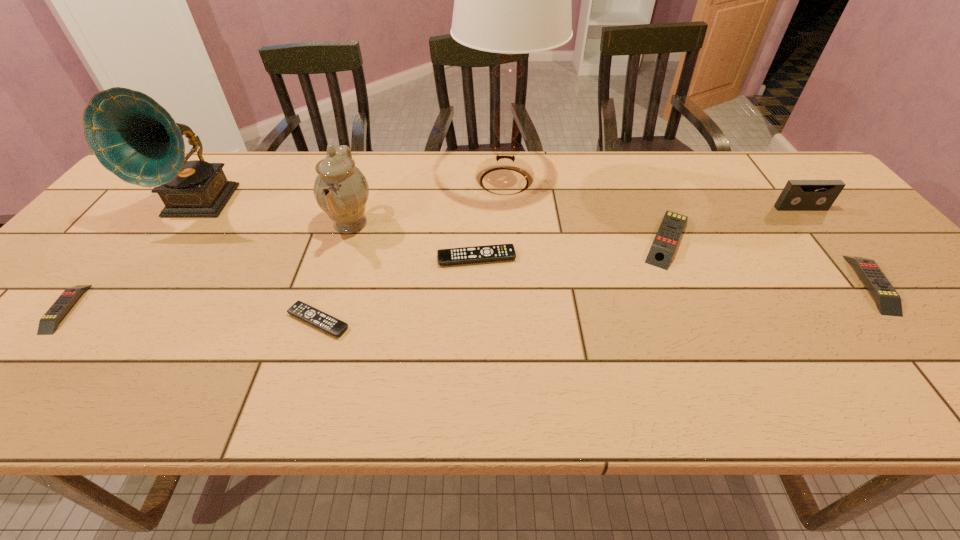
Locate an element on the screen. Image resolution: width=960 pixels, height=540 pixels. vacant area that satisfies the following two spatial constraints: 1. on the back side of the tallest remote control; 2. on the right side of the right black remote control is located at coordinates (477, 238).

You are a GUI agent. You are given a task and a screenshot of the screen. Output one action in this format:
    pyautogui.click(x=<x>, y=<y>)
    Task: Click on the vacant space that satisfies the following two spatial constraints: 1. on the front-facing side of the tallest object; 2. on the right side of the rightmost remote control
    The height and width of the screenshot is (540, 960).
    Given the screenshot: What is the action you would take?
    pyautogui.click(x=512, y=284)

The height and width of the screenshot is (540, 960). Identify the location of vacant region that satisfies the following two spatial constraints: 1. from the horn of the biggest yellow remote control; 2. on the right side of the phonograph_record. (174, 238).

The image size is (960, 540). In order to click on vacant position in the image that satisfies the following two spatial constraints: 1. on the front-facing side of the tallest object; 2. on the right side of the sixth tallest object in this screenshot , I will do `click(512, 284)`.

At what (x,y) coordinates should I click in order to perform the action: click on vacant space that satisfies the following two spatial constraints: 1. from the horn of the rightmost yellow remote control; 2. on the left side of the eighth shortest object. Please return your answer as a coordinate pair (x, y). Looking at the image, I should click on (140, 284).

At what (x,y) coordinates should I click in order to perform the action: click on free point that satisfies the following two spatial constraints: 1. on the front-facing side of the tallest object; 2. on the back side of the fifth tallest object. Please return your answer as a coordinate pair (x, y). Looking at the image, I should click on (508, 238).